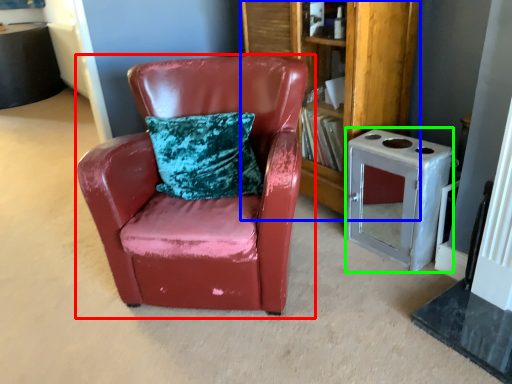
Question: Which object is positioned farthest from chair (highlighted by a red box)? Select from bookshelf (highlighted by a blue box) and appliance (highlighted by a green box).

Choices:
 (A) bookshelf
 (B) appliance

Answer: (B)